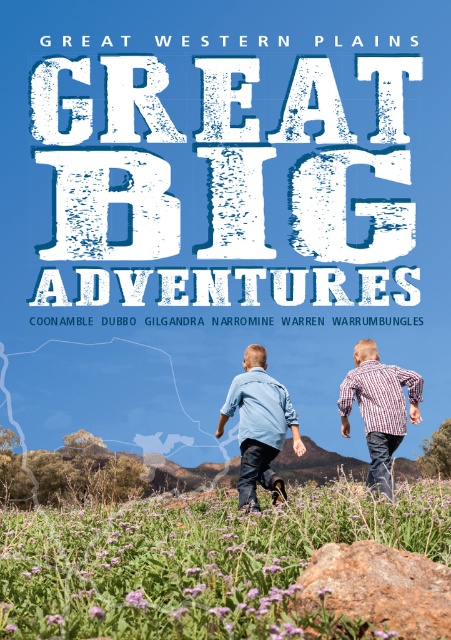
Question: Which object is closer to the camera taking this photo?

Choices:
 (A) purple soft-textured flowers at center
 (B) denim shirt at center
 (C) brown rough rock at center
 (D) striped cotton shirt at center

Answer: (A)

Question: Does brown rough rock at center appear over striped cotton shirt at center?

Choices:
 (A) yes
 (B) no

Answer: (B)

Question: Is purple soft-textured flowers at center positioned at the back of denim shirt at center?

Choices:
 (A) yes
 (B) no

Answer: (B)

Question: Is brown rough rock at center wider than denim shirt at center?

Choices:
 (A) yes
 (B) no

Answer: (B)

Question: Which object is positioned farthest from the striped cotton shirt at center?

Choices:
 (A) brown rough rock at center
 (B) purple soft-textured flowers at center
 (C) denim shirt at center

Answer: (A)

Question: Estimate the real-world distances between objects in this image. Which object is closer to the purple soft-textured flowers at center?

Choices:
 (A) striped cotton shirt at center
 (B) denim shirt at center

Answer: (B)